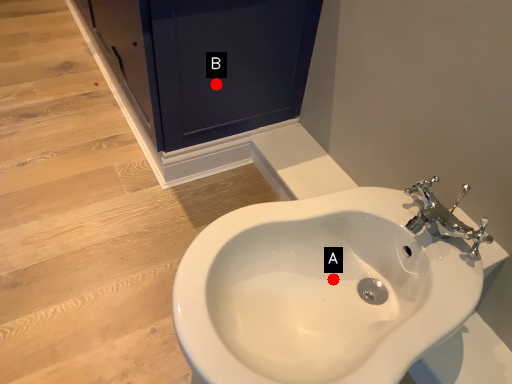
Question: Two points are circled on the image, labeled by A and B beside each circle. Among these points, which one is farthest from the camera?

Choices:
 (A) A is further
 (B) B is further

Answer: (B)